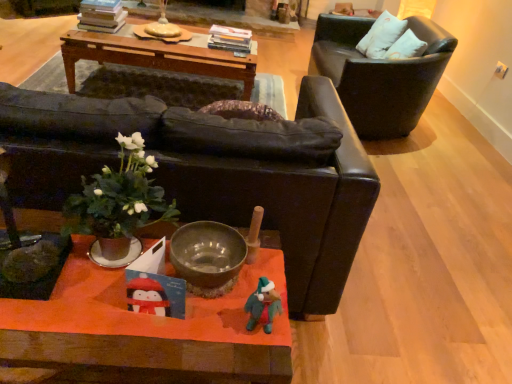
Describe the element at coordinates (381, 36) in the screenshot. I see `white fabric pillow at upper right` at that location.

Measure the distance between point [157,218] and camera.

Point [157,218] is 1.13 meters from camera.

Image resolution: width=512 pixels, height=384 pixels. What do you see at coordinates (155, 57) in the screenshot? I see `woodenmaterial/texturetable at upper center` at bounding box center [155, 57].

Locate an element on the screen. The height and width of the screenshot is (384, 512). matte black couch at center, the 2th chair positioned from the back is located at coordinates (222, 176).

The image size is (512, 384). What do you see at coordinates (222, 176) in the screenshot?
I see `matte black couch at center, which ranks as the 2th chair in right-to-left order` at bounding box center [222, 176].

This screenshot has height=384, width=512. Identify the location of felt-like green toy at lower center. (263, 304).

This screenshot has width=512, height=384. In order to click on wooden orange coffee table at center in this screenshot , I will do `click(145, 331)`.

Considering their positions, is woodenmaterial/texturetable at upper center located in front of or behind matte black couch at center, arranged as the first chair when viewed from the left?

woodenmaterial/texturetable at upper center is behind matte black couch at center, arranged as the first chair when viewed from the left.

From the image's perspective, which object appears higher, woodenmaterial/texturetable at upper center or matte black couch at center, which ranks as the 2th chair in right-to-left order?

woodenmaterial/texturetable at upper center is shown above in the image.

Is woodenmaterial/texturetable at upper center smaller than matte black couch at center, arranged as the first chair when viewed from the left?

Yes.

Is black leather chair at upper right, positioned as the first chair in back-to-front order, aimed at woodenmaterial/texturetable at upper center?

Yes.

From a real-world perspective, is black leather chair at upper right, positioned as the first chair in back-to-front order, positioned under woodenmaterial/texturetable at upper center based on gravity?

No, from a real-world perspective, black leather chair at upper right, positioned as the first chair in back-to-front order, is not below woodenmaterial/texturetable at upper center.

Is black leather chair at upper right, placed as the 2th chair when sorted from left to right, to the right of woodenmaterial/texturetable at upper center from the viewer's perspective?

Indeed, black leather chair at upper right, placed as the 2th chair when sorted from left to right, is positioned on the right side of woodenmaterial/texturetable at upper center.

Considering the relative sizes of wooden orange coffee table at center and black leather chair at upper right, the 1th chair viewed from the right, in the image provided, is wooden orange coffee table at center bigger than black leather chair at upper right, the 1th chair viewed from the right,?

Actually, wooden orange coffee table at center might be smaller than black leather chair at upper right, the 1th chair viewed from the right.

Is wooden orange coffee table at center beside black leather chair at upper right, positioned as the first chair in back-to-front order?

There is a gap between wooden orange coffee table at center and black leather chair at upper right, positioned as the first chair in back-to-front order.

Is black leather chair at upper right, placed as the 2th chair when sorted from left to right, at the back of wooden orange coffee table at center?

Yes.

Looking at this image, from the image's perspective, between wooden orange coffee table at center and black leather chair at upper right, positioned as the first chair in back-to-front order, which one is located above?

black leather chair at upper right, positioned as the first chair in back-to-front order, from the image's perspective.

Is white fabric pillow at upper right turned away from matte black couch at center, the 2th chair positioned from the back?

white fabric pillow at upper right does not have its back to matte black couch at center, the 2th chair positioned from the back.

Considering the positions of objects white fabric pillow at upper right and matte black couch at center, arranged as the first chair when viewed from the left, in the image provided, who is more to the left, white fabric pillow at upper right or matte black couch at center, arranged as the first chair when viewed from the left,?

matte black couch at center, arranged as the first chair when viewed from the left, is more to the left.

From a real-world perspective, is white fabric pillow at upper right over matte black couch at center, the 2th chair positioned from the back?

Yes, from a real-world perspective, white fabric pillow at upper right is over matte black couch at center, the 2th chair positioned from the back

Is matte black couch at center, the 2th chair positioned from the back, a part of white fabric pillow at upper right?

No, matte black couch at center, the 2th chair positioned from the back, is not surrounded by white fabric pillow at upper right.

Which is in front, point (75, 377) or point (365, 44)?

The point (75, 377) is in front.

Does wooden orange coffee table at center lie in front of white fabric pillow at upper right?

Yes, the depth of wooden orange coffee table at center is less than that of white fabric pillow at upper right.

From the image's perspective, is wooden orange coffee table at center on white fabric pillow at upper right?

No.

Is wooden orange coffee table at center to the right of white fabric pillow at upper right from the viewer's perspective?

No.

From the image's perspective, is matte black couch at center, the 2th chair positioned from the back, over woodenmaterial/texturetable at upper center?

Incorrect, from the image's perspective, matte black couch at center, the 2th chair positioned from the back, is lower than woodenmaterial/texturetable at upper center.

Considering the positions of objects matte black couch at center, the 1th chair when ordered from front to back, and woodenmaterial/texturetable at upper center in the image provided, who is more to the left, matte black couch at center, the 1th chair when ordered from front to back, or woodenmaterial/texturetable at upper center?

woodenmaterial/texturetable at upper center is more to the left.

Do you think matte black couch at center, the 1th chair when ordered from front to back, is within woodenmaterial/texturetable at upper center, or outside of it?

The correct answer is: outside.

From a real-world perspective, is black leather chair at upper right, the 1th chair viewed from the right, below green leafy plant at center?

Yes, from a real-world perspective, black leather chair at upper right, the 1th chair viewed from the right, is under green leafy plant at center.

Does black leather chair at upper right, positioned as the first chair in back-to-front order, have a lesser width compared to green leafy plant at center?

No.

From the image's perspective, does black leather chair at upper right, placed as the 2th chair when sorted from left to right, appear higher than green leafy plant at center?

Yes, from the image's perspective, black leather chair at upper right, placed as the 2th chair when sorted from left to right, is on top of green leafy plant at center.

Measure the distance from black leather chair at upper right, acting as the second chair starting from the front, to green leafy plant at center.

black leather chair at upper right, acting as the second chair starting from the front, and green leafy plant at center are 2.13 meters apart.

You are a GUI agent. You are given a task and a screenshot of the screen. Output one action in this format:
    pyautogui.click(x=<x>, y=<y>)
    Task: Click on the 2nd chair below the woodenmaterial/texturetable at upper center (from the image's perspective)
    Image resolution: width=512 pixels, height=384 pixels.
    Given the screenshot: What is the action you would take?
    pyautogui.click(x=222, y=176)

Locate an element on the screen. table on the left of the black leather chair at upper right, positioned as the first chair in back-to-front order is located at coordinates (155, 57).

From the image, which object appears to be farther from matte black couch at center, the 2th chair positioned from the back, woodenmaterial/texturetable at upper center or wooden orange coffee table at center?

Among the two, woodenmaterial/texturetable at upper center is located further to matte black couch at center, the 2th chair positioned from the back.

When comparing their distances from matte black couch at center, the 1th chair when ordered from front to back, does green leafy plant at center or white fabric pillow at upper right seem further?

Among the two, white fabric pillow at upper right is located further to matte black couch at center, the 1th chair when ordered from front to back.

Estimate the real-world distances between objects in this image. Which object is further from wooden orange coffee table at center, matte black couch at center, which ranks as the 2th chair in right-to-left order, or woodenmaterial/texturetable at upper center?

Among the two, woodenmaterial/texturetable at upper center is located further to wooden orange coffee table at center.

When comparing their distances from woodenmaterial/texturetable at upper center, does matte black couch at center, the 1th chair when ordered from front to back, or metallic silver bowl at center seem further?

Based on the image, metallic silver bowl at center appears to be further to woodenmaterial/texturetable at upper center.

Considering their positions, is white fabric pillow at upper right positioned closer to felt-like green toy at lower center than green leafy plant at center?

green leafy plant at center is closer to felt-like green toy at lower center.

Looking at the image, which one is located further to green leafy plant at center, matte black couch at center, which ranks as the 2th chair in right-to-left order, or woodenmaterial/texturetable at upper center?

The object further to green leafy plant at center is woodenmaterial/texturetable at upper center.

Which object lies further to the anchor point white fabric pillow at upper right, green leafy plant at center or wooden orange coffee table at center?

wooden orange coffee table at center is further to white fabric pillow at upper right.

In the scene shown: When comparing their distances from woodenmaterial/texturetable at upper center, does matte black couch at center, which ranks as the 2th chair in right-to-left order, or felt-like green toy at lower center seem closer?

matte black couch at center, which ranks as the 2th chair in right-to-left order.

Identify the location of houseplant located between wooden orange coffee table at center and woodenmaterial/texturetable at upper center in the depth direction. Image resolution: width=512 pixels, height=384 pixels. (119, 201).

Image resolution: width=512 pixels, height=384 pixels. I want to click on bowl between felt-like green toy at lower center and white fabric pillow at upper right in the front-back direction, so click(x=207, y=253).

The width and height of the screenshot is (512, 384). What are the coordinates of `houseplant situated between matte black couch at center, which ranks as the 2th chair in right-to-left order, and felt-like green toy at lower center from left to right` in the screenshot? It's located at (119, 201).

Image resolution: width=512 pixels, height=384 pixels. In order to click on bowl positioned between green leafy plant at center and white fabric pillow at upper right from near to far in this screenshot , I will do `click(207, 253)`.